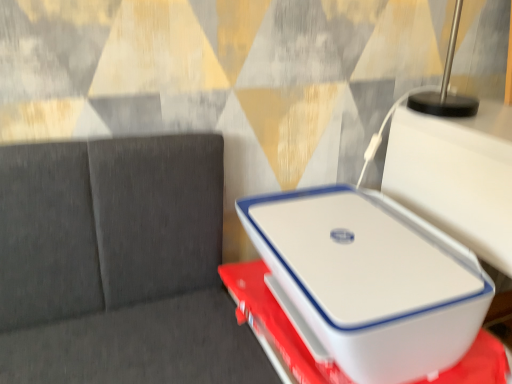
Question: From the image's perspective, is white plastic container at center located above or below white plastic laptop at center?

Choices:
 (A) below
 (B) above

Answer: (A)

Question: Visually, is white plastic container at center positioned to the left or to the right of white plastic laptop at center?

Choices:
 (A) right
 (B) left

Answer: (A)

Question: Looking at the image, does white plastic container at center seem bigger or smaller compared to white plastic laptop at center?

Choices:
 (A) small
 (B) big

Answer: (A)

Question: Do you think white plastic laptop at center is within white plastic container at center, or outside of it?

Choices:
 (A) inside
 (B) outside

Answer: (B)

Question: Is white plastic laptop at center in front of or behind white plastic container at center in the image?

Choices:
 (A) behind
 (B) front

Answer: (A)

Question: Considering the relative positions of white plastic laptop at center and white plastic container at center in the image provided, is white plastic laptop at center to the left or to the right of white plastic container at center?

Choices:
 (A) left
 (B) right

Answer: (A)

Question: Looking at their shapes, would you say white plastic laptop at center is wider or thinner than white plastic container at center?

Choices:
 (A) thin
 (B) wide

Answer: (A)